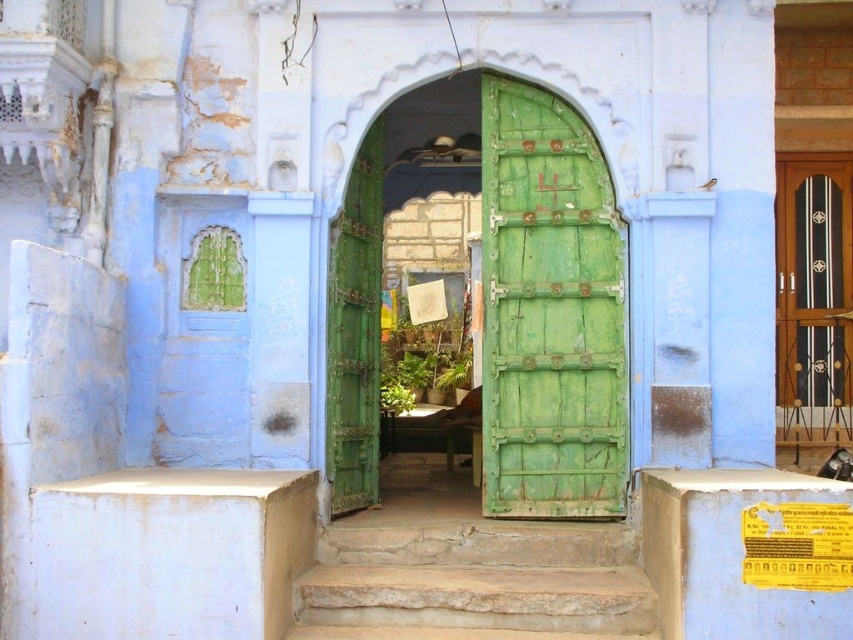
You are standing in front of the green weathered wood door at center. What are the coordinates of the door?

Answer: The coordinates of the green weathered wood door at center are at point (550, 310).

Consider the image. You are standing in front of the green wooden door at center. If you want to open it, where should you push? Please answer with either left, right, top, or bottom.

Since the green wooden door at center is a standard door, you should push the bottom part to open it.

You are a visitor approaching the green wooden door at center and the stone steps at center. Which one is located to the right when facing the entrance?

The green wooden door at center is positioned on the right side of stone steps at center, so when facing the entrance, the green wooden door at center is to the right of the stone steps at center.